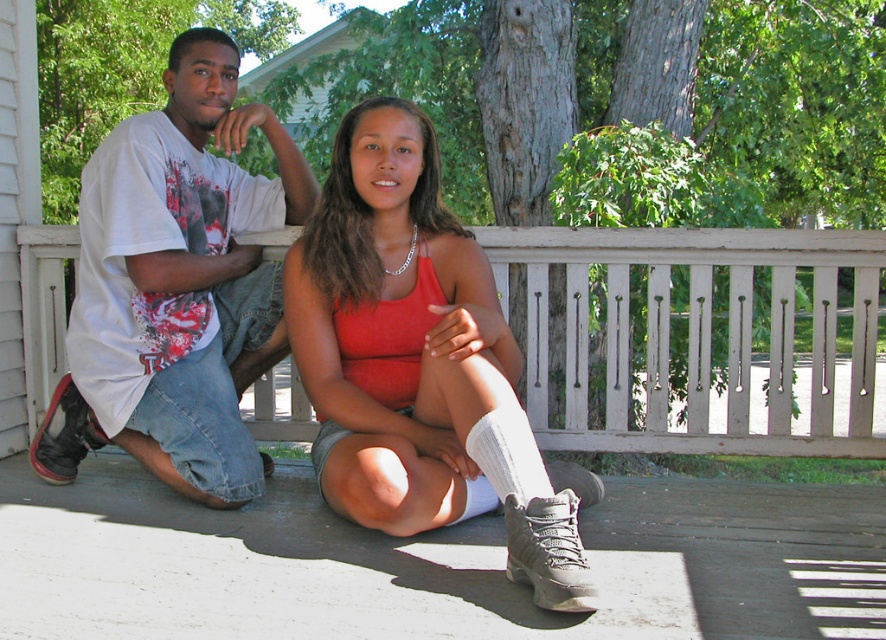
You are a delivery robot with a package that requires a flat surface to place it. The package is 1.2 meters long. You see the white wooden porch at center and the white knit sock at lower center. Can you place the package horizontally between them without it hanging off the edge?

The distance between the white wooden porch at center and the white knit sock at lower center is 1.24 meters. Since the package is 1.2 meters long, it can be placed horizontally between them as the space is slightly larger than the package length.

You are standing in front of the porch and want to place a small potted plant exactly at the point marked by coordinates point (702, 337). According to the scene description, where on the porch should you place the potted plant?

The point (702, 337) is located on the white wooden porch at center, so you should place the potted plant on the white wooden porch at center.